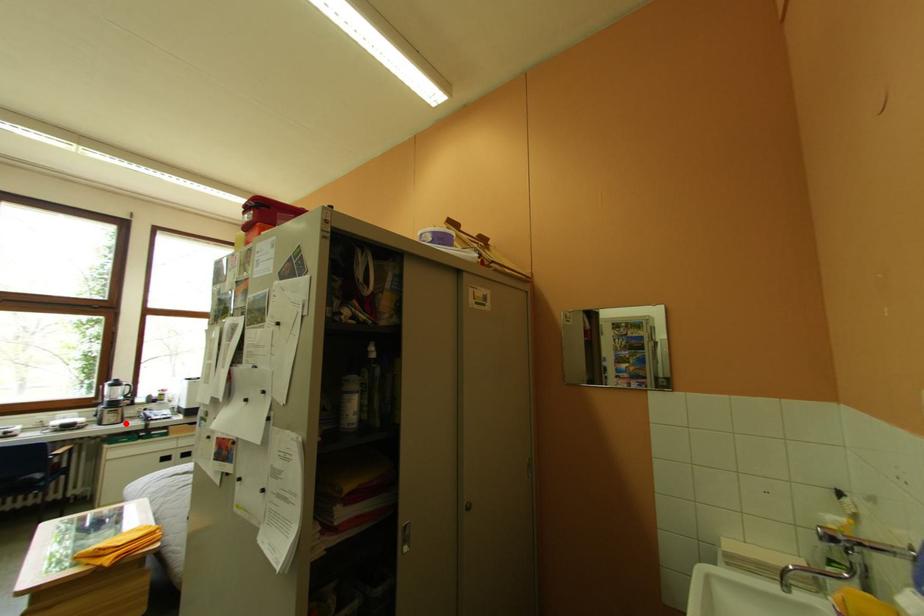
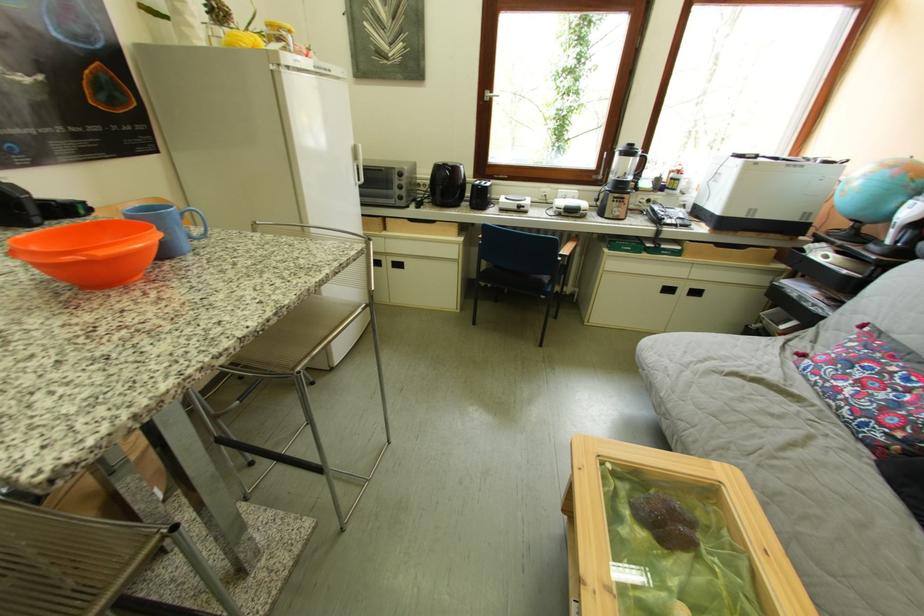
Question: I am providing you with two images of the same scene from different viewpoints. A red point is marked on the first image. Can you still see the location of the red point in image 2?

Choices:
 (A) Yes
 (B) No

Answer: (A)